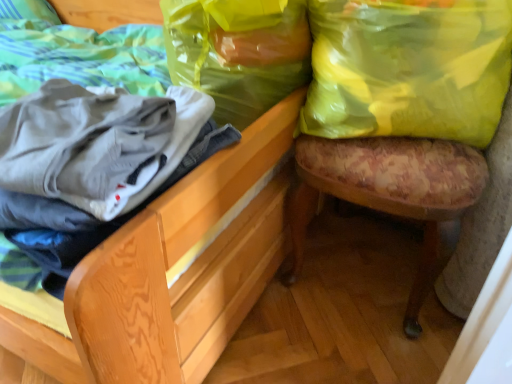
Question: Is translucent yellow plastic bag at upper right, which is the second shopping bag in right-to-left order, outside wooden chair at lower right?

Choices:
 (A) no
 (B) yes

Answer: (A)

Question: Is translucent yellow plastic bag at upper right, which is the second shopping bag in right-to-left order, turned away from wooden chair at lower right?

Choices:
 (A) no
 (B) yes

Answer: (B)

Question: Is translucent yellow plastic bag at upper right, which is the second shopping bag in right-to-left order, behind wooden chair at lower right?

Choices:
 (A) yes
 (B) no

Answer: (A)

Question: Is translucent yellow plastic bag at upper right, the 1th shopping bag viewed from the left, smaller than wooden chair at lower right?

Choices:
 (A) yes
 (B) no

Answer: (A)

Question: Is translucent yellow plastic bag at upper right, which is the second shopping bag in right-to-left order, bigger than wooden chair at lower right?

Choices:
 (A) yes
 (B) no

Answer: (B)

Question: Does translucent yellow plastic bag at upper right, which is the second shopping bag in right-to-left order, have a greater width compared to wooden chair at lower right?

Choices:
 (A) yes
 (B) no

Answer: (B)

Question: From a real-world perspective, is yellow plastic bag at upper right, which ranks as the 1th shopping bag in right-to-left order, over floral fabric stool at right?

Choices:
 (A) yes
 (B) no

Answer: (A)

Question: From the image's perspective, is yellow plastic bag at upper right, which ranks as the 1th shopping bag in right-to-left order, on floral fabric stool at right?

Choices:
 (A) yes
 (B) no

Answer: (A)

Question: Is yellow plastic bag at upper right, which ranks as the 1th shopping bag in right-to-left order, completely or partially outside of floral fabric stool at right?

Choices:
 (A) yes
 (B) no

Answer: (B)

Question: Considering the relative sizes of yellow plastic bag at upper right, which ranks as the 1th shopping bag in right-to-left order, and floral fabric stool at right in the image provided, is yellow plastic bag at upper right, which ranks as the 1th shopping bag in right-to-left order, bigger than floral fabric stool at right?

Choices:
 (A) yes
 (B) no

Answer: (B)

Question: Could you tell me if yellow plastic bag at upper right, which is the 2th shopping bag in left-to-right order, is turned towards floral fabric stool at right?

Choices:
 (A) no
 (B) yes

Answer: (B)

Question: From the image's perspective, is yellow plastic bag at upper right, which is the 2th shopping bag in left-to-right order, located beneath floral fabric stool at right?

Choices:
 (A) yes
 (B) no

Answer: (B)

Question: Does translucent yellow plastic bag at upper right, the 1th shopping bag viewed from the left, have a greater height compared to floral fabric stool at right?

Choices:
 (A) yes
 (B) no

Answer: (B)